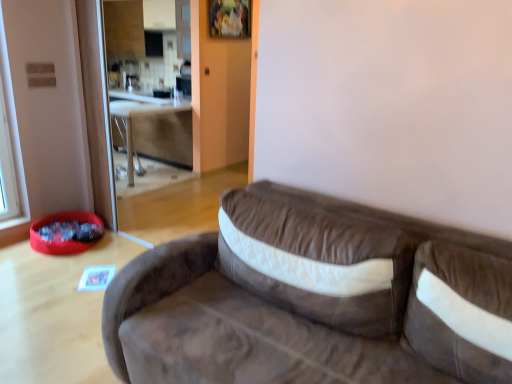
Describe the element at coordinates (141, 115) in the screenshot. I see `wooden table at center` at that location.

Measure the distance between wooden table at center and camera.

The depth of wooden table at center is 4.56 meters.

Find the location of `wooden table at center`. wooden table at center is located at coordinates (141, 115).

Measure the distance between point (113, 110) and camera.

Point (113, 110) and camera are 4.62 meters apart from each other.

Describe the element at coordinates (303, 301) in the screenshot. I see `brown suede studio couch at center` at that location.

The width and height of the screenshot is (512, 384). Identify the location of brown suede studio couch at center. (303, 301).

This screenshot has width=512, height=384. Identify the location of wooden table at center. click(141, 115).

Considering the relative positions of wooden table at center and brown suede studio couch at center in the image provided, is wooden table at center to the left of brown suede studio couch at center from the viewer's perspective?

Yes.

Which object is further away from the camera, wooden table at center or brown suede studio couch at center?

wooden table at center.

Is point (130, 133) farther from viewer compared to point (179, 262)?

That is True.

Consider the image. From the image's perspective, is wooden table at center on brown suede studio couch at center?

Indeed, from the image's perspective, wooden table at center is shown above brown suede studio couch at center.

From a real-world perspective, is wooden table at center physically above brown suede studio couch at center?

No, from a real-world perspective, wooden table at center is not above brown suede studio couch at center.

Considering the relative sizes of wooden table at center and brown suede studio couch at center in the image provided, is wooden table at center thinner than brown suede studio couch at center?

Yes, wooden table at center is thinner than brown suede studio couch at center.

Can you confirm if wooden table at center is taller than brown suede studio couch at center?

No, wooden table at center is not taller than brown suede studio couch at center.

Is wooden table at center bigger than brown suede studio couch at center?

No.

Is brown suede studio couch at center surrounded by wooden table at center?

No.

Is the surface of wooden table at center in direct contact with brown suede studio couch at center?

wooden table at center and brown suede studio couch at center are clearly separated.

Is wooden table at center facing away from brown suede studio couch at center?

wooden table at center does not have its back to brown suede studio couch at center.

How different are the orientations of wooden table at center and brown suede studio couch at center in degrees?

The angle between the facing direction of wooden table at center and the facing direction of brown suede studio couch at center is 90.4 degrees.

This screenshot has width=512, height=384. Find the location of `table on the left of brown suede studio couch at center`. table on the left of brown suede studio couch at center is located at coordinates (141, 115).

Can you confirm if brown suede studio couch at center is positioned to the left of wooden table at center?

Incorrect, brown suede studio couch at center is not on the left side of wooden table at center.

Who is more distant, brown suede studio couch at center or wooden table at center?

wooden table at center.

Is point (382, 295) closer to camera compared to point (115, 110)?

Yes, it is in front of point (115, 110).

From the image's perspective, is brown suede studio couch at center located above or below wooden table at center?

Clearly, from the image's perspective, brown suede studio couch at center is below wooden table at center.

From a real-world perspective, between brown suede studio couch at center and wooden table at center, who is vertically lower?

wooden table at center.

Between brown suede studio couch at center and wooden table at center, which one has smaller width?

wooden table at center.

In terms of height, does brown suede studio couch at center look taller or shorter compared to wooden table at center?

Considering their sizes, brown suede studio couch at center has more height than wooden table at center.

In terms of size, does brown suede studio couch at center appear bigger or smaller than wooden table at center?

Clearly, brown suede studio couch at center is larger in size than wooden table at center.

Do you think brown suede studio couch at center is within wooden table at center, or outside of it?

brown suede studio couch at center is spatially situated outside wooden table at center.

Is brown suede studio couch at center placed right next to wooden table at center?

They are not placed beside each other.

Based on the photo, is brown suede studio couch at center turned away from wooden table at center?

No, brown suede studio couch at center is not facing away from wooden table at center.

Measure the distance between brown suede studio couch at center and wooden table at center.

brown suede studio couch at center is 3.36 meters away from wooden table at center.

At what (x,y) coordinates should I click in order to perform the action: click on studio couch above the wooden table at center (from a real-world perspective). Please return your answer as a coordinate pair (x, y). Looking at the image, I should click on (303, 301).

Find the location of a particular element. This screenshot has height=384, width=512. studio couch lying in front of the wooden table at center is located at coordinates (303, 301).

Find the location of a particular element. studio couch to the right of wooden table at center is located at coordinates (303, 301).